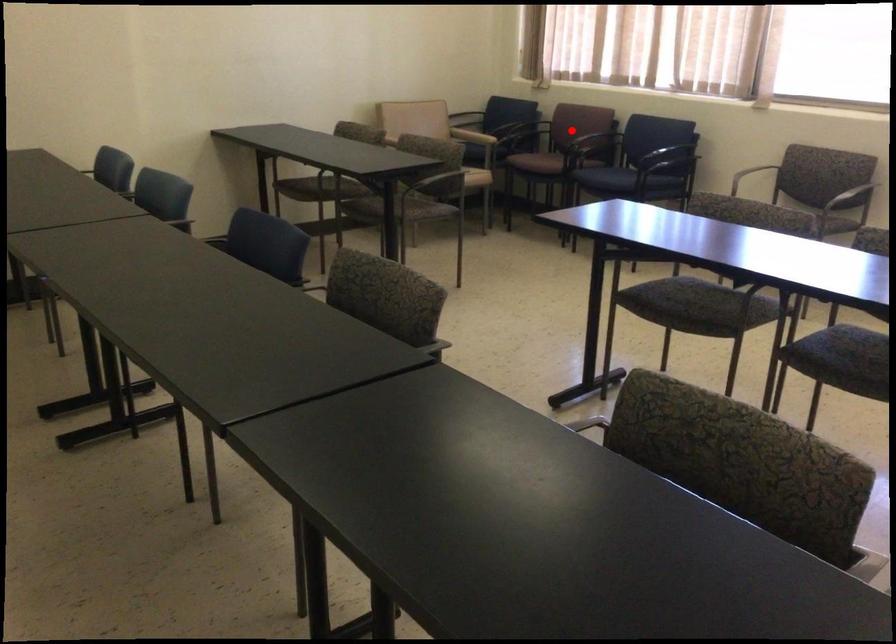
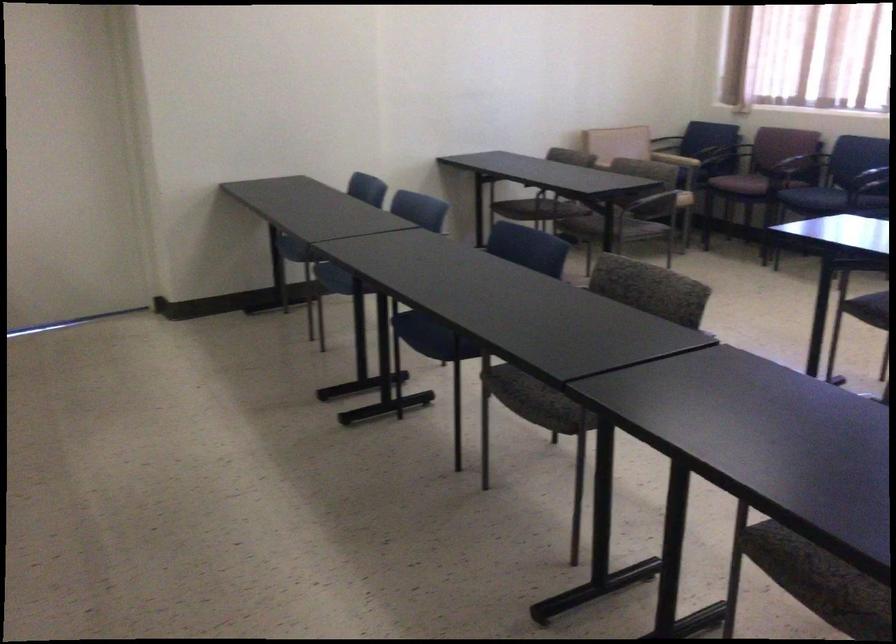
In the second image, find the point that corresponds to the highlighted location in the first image.

(776, 156)